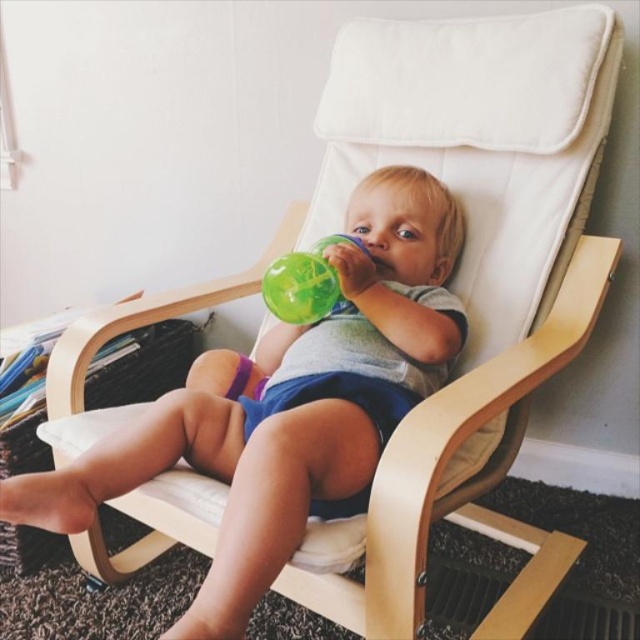
You are a parent looking at the two cups in front of your child. The child is holding the matte green sippy cup at center. You want to give them the other cup which is the translucent green cup at center. Can you hand it to them without moving the current cup? Explain why based on their sizes.

The matte green sippy cup at center is much taller than the translucent green cup at center. Since the translucent green cup at center is shorter, it can be placed beside the current cup without needing to move it, allowing you to hand it to the child.

You are a photographer trying to capture a closeup shot of the child drinking from the green sippy cup with a blue lid. The camera is positioned at the camera center. You want to focus on the point at point (68, 509). If the camera can focus on objects within 30 inches, will the point be in focus?

The point (68, 509) is 31.32 inches from the camera, which is slightly beyond the 30 inch focus range. The point will not be in focus.

You are a parent trying to choose between the matte green sippy cup at center and the translucent green cup at center for your child. Based on the size, which one would be more suitable for a toddler who prefers drinking from larger cups?

The matte green sippy cup at center is larger in size than the translucent green cup at center, so it would be more suitable for a toddler who prefers drinking from larger cups.